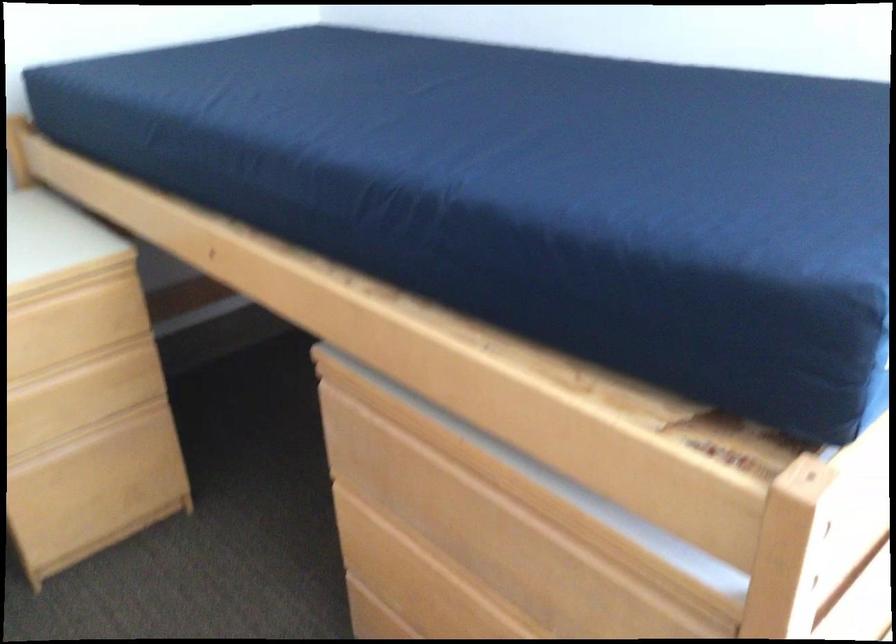
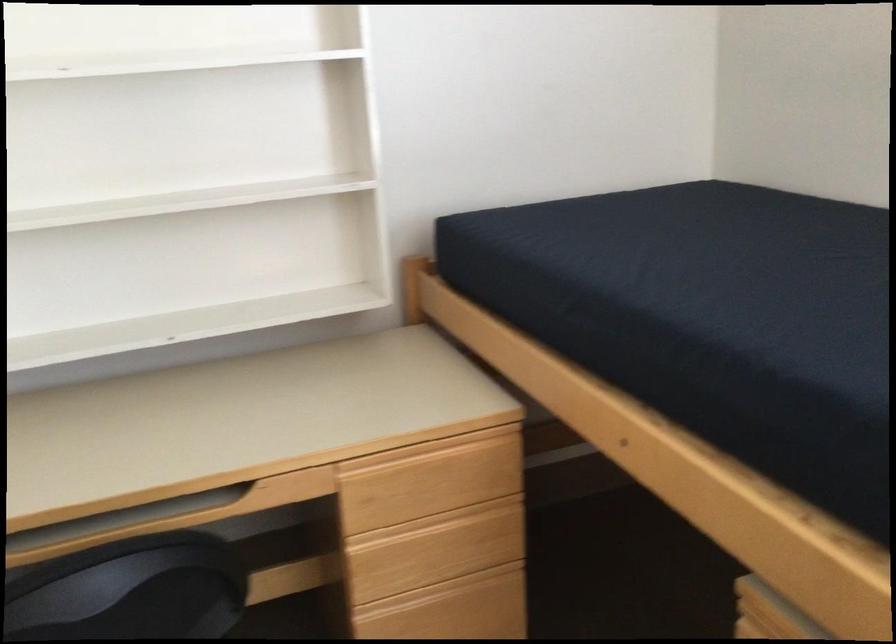
Find the pixel in the second image that matches [73,375] in the first image.

(443, 524)